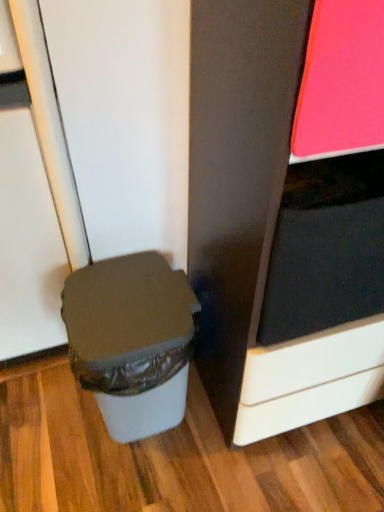
The width and height of the screenshot is (384, 512). Describe the element at coordinates (132, 341) in the screenshot. I see `white plastic waste bin at lower left` at that location.

Where is `white plastic waste bin at lower left`? This screenshot has width=384, height=512. white plastic waste bin at lower left is located at coordinates (132, 341).

Locate an element on the screen. This screenshot has width=384, height=512. matte black cabinet at right is located at coordinates (288, 208).

This screenshot has width=384, height=512. What do you see at coordinates (288, 208) in the screenshot?
I see `matte black cabinet at right` at bounding box center [288, 208].

Where is `white plastic waste bin at lower left`? This screenshot has height=512, width=384. white plastic waste bin at lower left is located at coordinates (132, 341).

Considering the positions of objects matte black cabinet at right and white plastic waste bin at lower left in the image provided, who is more to the left, matte black cabinet at right or white plastic waste bin at lower left?

From the viewer's perspective, white plastic waste bin at lower left appears more on the left side.

Considering their positions, is matte black cabinet at right located in front of or behind white plastic waste bin at lower left?

matte black cabinet at right is in front of white plastic waste bin at lower left.

Between point (241, 155) and point (92, 322), which one is positioned behind?

The point (92, 322) is farther.

From the image's perspective, is matte black cabinet at right positioned above or below white plastic waste bin at lower left?

Based on their image positions, matte black cabinet at right is located above white plastic waste bin at lower left.

From a real-world perspective, is matte black cabinet at right physically above white plastic waste bin at lower left?

Correct, in the physical world, matte black cabinet at right is higher than white plastic waste bin at lower left.

Looking at this image, which of these two, matte black cabinet at right or white plastic waste bin at lower left, is wider?

matte black cabinet at right.

From their relative heights in the image, would you say matte black cabinet at right is taller or shorter than white plastic waste bin at lower left?

matte black cabinet at right is shorter than white plastic waste bin at lower left.

Is matte black cabinet at right bigger or smaller than white plastic waste bin at lower left?

Considering their sizes, matte black cabinet at right takes up less space than white plastic waste bin at lower left.

Is matte black cabinet at right spatially inside white plastic waste bin at lower left, or outside of it?

matte black cabinet at right is located beyond the bounds of white plastic waste bin at lower left.

Is matte black cabinet at right positioned far away from white plastic waste bin at lower left?

No.

Could you tell me if matte black cabinet at right is turned towards white plastic waste bin at lower left?

No, matte black cabinet at right is not aimed at white plastic waste bin at lower left.

This screenshot has height=512, width=384. There is a white plastic waste bin at lower left. Find the location of `cabinetry above it (from a real-world perspective)`. cabinetry above it (from a real-world perspective) is located at coordinates (288, 208).

Is white plastic waste bin at lower left at the right side of matte black cabinet at right?

Incorrect, white plastic waste bin at lower left is not on the right side of matte black cabinet at right.

Relative to matte black cabinet at right, is white plastic waste bin at lower left in front or behind?

Visually, white plastic waste bin at lower left is located behind matte black cabinet at right.

Does point (148, 381) appear closer or farther from the camera than point (205, 1)?

Point (148, 381).

From the image's perspective, which one is positioned higher, white plastic waste bin at lower left or matte black cabinet at right?

matte black cabinet at right.

From a real-world perspective, is white plastic waste bin at lower left on top of matte black cabinet at right?

No, from a real-world perspective, white plastic waste bin at lower left is not above matte black cabinet at right.

Considering the sizes of white plastic waste bin at lower left and matte black cabinet at right in the image, is white plastic waste bin at lower left wider or thinner than matte black cabinet at right?

Clearly, white plastic waste bin at lower left has less width compared to matte black cabinet at right.

Considering the sizes of white plastic waste bin at lower left and matte black cabinet at right in the image, is white plastic waste bin at lower left taller or shorter than matte black cabinet at right?

Clearly, white plastic waste bin at lower left is taller compared to matte black cabinet at right.

Can you confirm if white plastic waste bin at lower left is smaller than matte black cabinet at right?

No.

Is white plastic waste bin at lower left positioned beyond the bounds of matte black cabinet at right?

That's correct, white plastic waste bin at lower left is outside of matte black cabinet at right.

Is white plastic waste bin at lower left next to matte black cabinet at right?

No, white plastic waste bin at lower left is not touching matte black cabinet at right.

Could you tell me if white plastic waste bin at lower left is facing matte black cabinet at right?

No, white plastic waste bin at lower left is not turned towards matte black cabinet at right.

Where is `cabinetry located above the white plastic waste bin at lower left (from a real-world perspective)`? The image size is (384, 512). cabinetry located above the white plastic waste bin at lower left (from a real-world perspective) is located at coordinates (288, 208).

This screenshot has width=384, height=512. In order to click on cabinetry in front of the white plastic waste bin at lower left in this screenshot , I will do `click(288, 208)`.

Locate an element on the screen. Image resolution: width=384 pixels, height=512 pixels. cabinetry that appears above the white plastic waste bin at lower left (from the image's perspective) is located at coordinates [x=288, y=208].